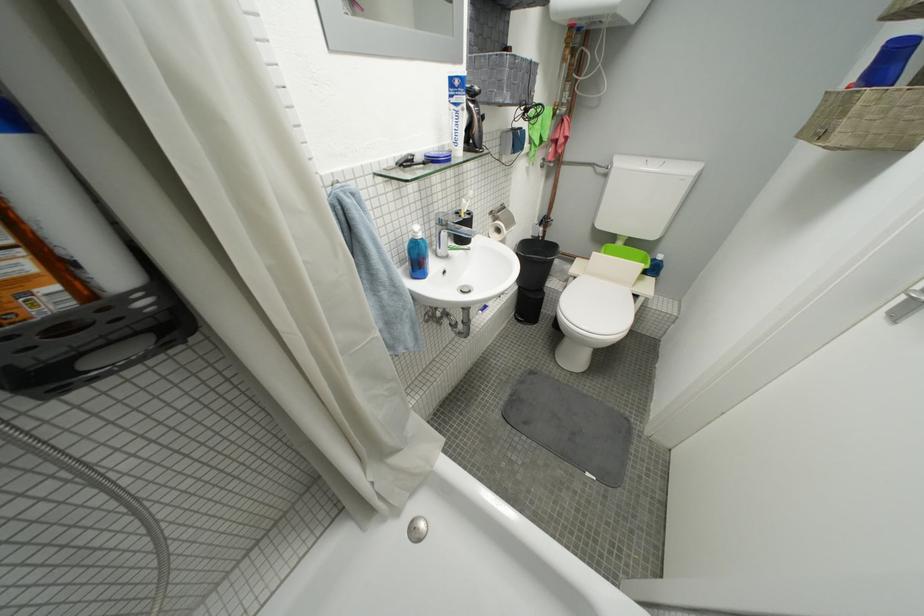
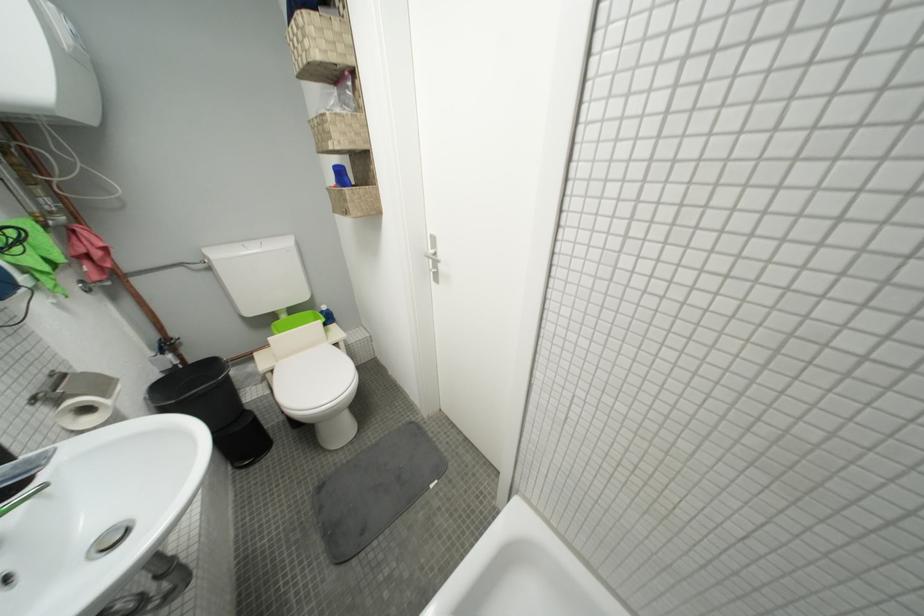
The point at (553,224) is marked in the first image. Where is the corresponding point in the second image?

(175, 347)